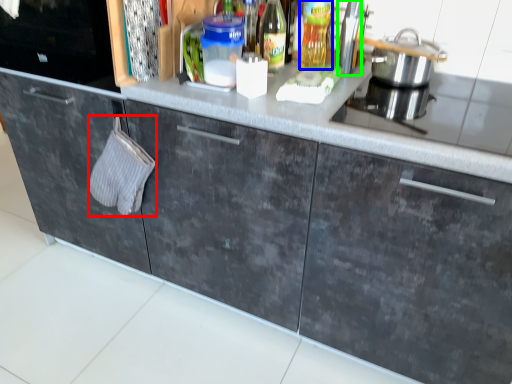
Question: Which object is positioned closest to hand towel (highlighted by a red box)? Select from bottle (highlighted by a blue box) and appliance (highlighted by a green box).

Choices:
 (A) bottle
 (B) appliance

Answer: (A)